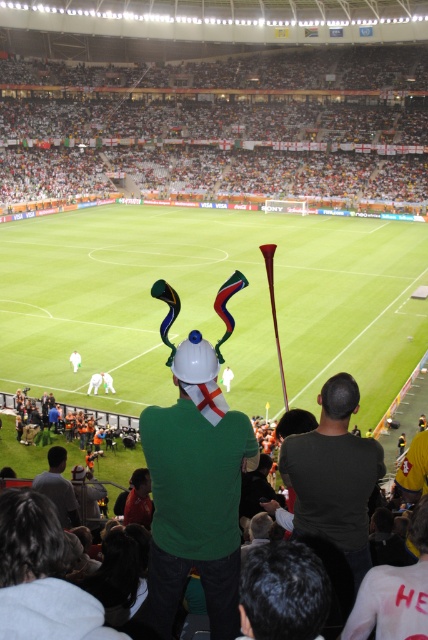
You are a photographer standing at the edge of the soccer field. You want to take a photo that includes both the dark brown hair at center and the gray fabric shirt at lower left. Given that your camera has a maximum focus range of 8 meters, will you be able to capture both subjects in the same frame?

The distance between the dark brown hair at center and the gray fabric shirt at lower left is 7.57 meters, which is within the camera maximum focus range of 8 meters. Therefore, you can capture both subjects in the same frame.

You are a photographer at the soccer stadium trying to capture the gray fabric shirt at lower left. To avoid blocking the view of the white plastic flags at upper center, where should you position your camera?

To capture the gray fabric shirt at lower left without blocking the view of the white plastic flags at upper center, position your camera below the white plastic flags at upper center since they are located above the gray fabric shirt at lower left.

You are a photographer trying to capture a clear shot of the green matte helmet at center without the white plastic flags at upper center blocking it. Based on their sizes, is this possible?

The white plastic flags at upper center might be wider than green matte helmet at center, so there is a possibility that the flags could block the view of the helmet depending on their exact positioning and distance from the camera.